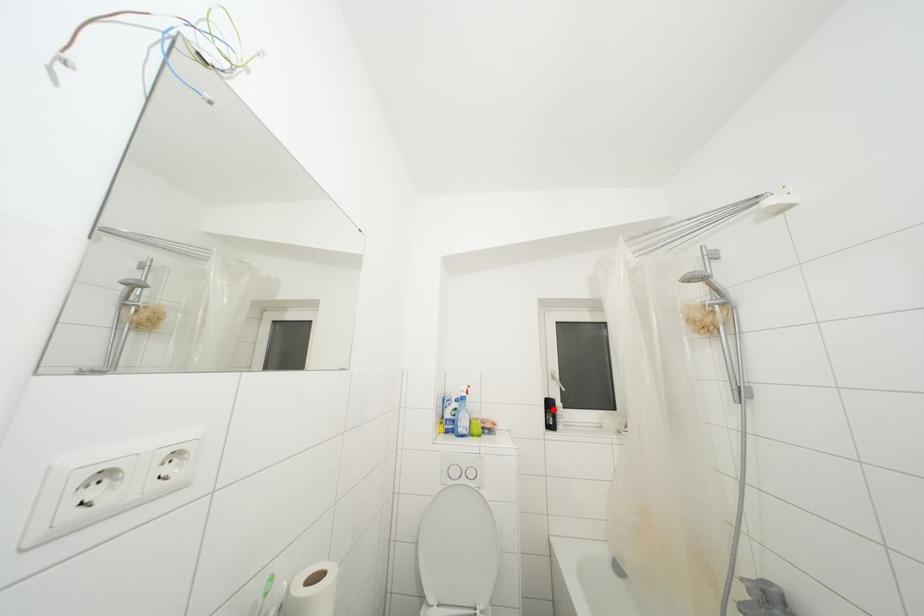
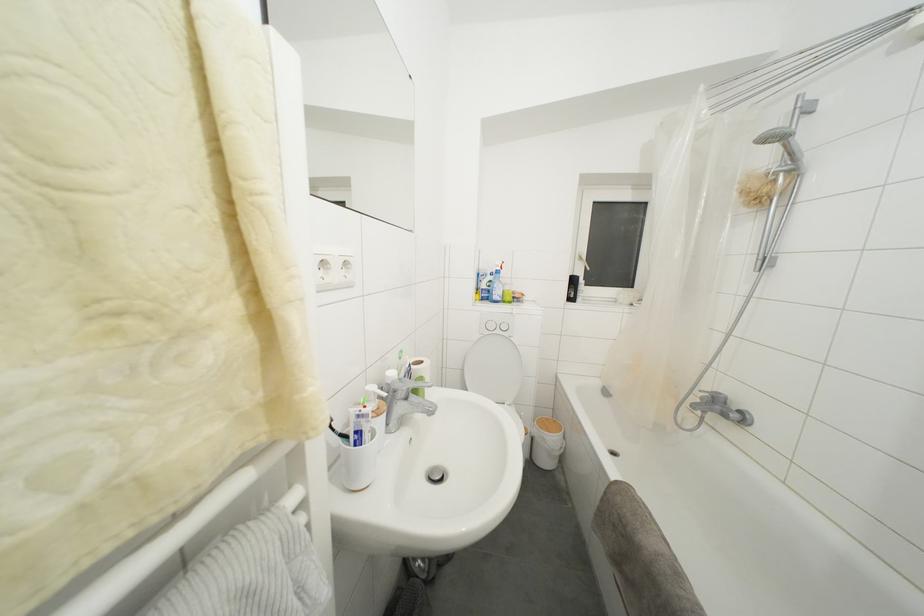
Locate, in the second image, the point that corresponds to the highlighted location in the first image.

(578, 286)